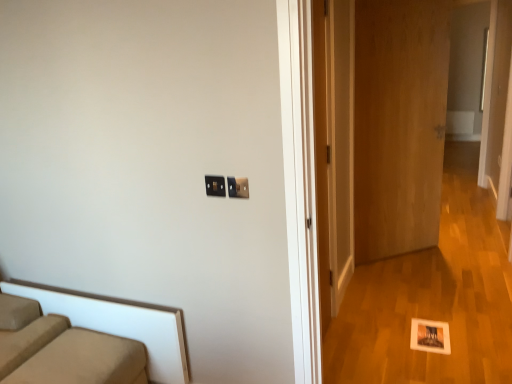
From the picture: What is the approximate height of wooden door at right, which is the 1th door in left-to-right order?

6.33 feet.

The image size is (512, 384). In order to click on wooden door at right, which is the 1th door in front-to-back order in this screenshot , I will do `click(334, 145)`.

Is matte black switch at upper center, the first electric outlet positioned from the right, at the left side of beige fabric studio couch at lower left?

In fact, matte black switch at upper center, the first electric outlet positioned from the right, is to the right of beige fabric studio couch at lower left.

From the image's perspective, is matte black switch at upper center, which ranks as the second electric outlet in left-to-right order, positioned above or below beige fabric studio couch at lower left?

Clearly, from the image's perspective, matte black switch at upper center, which ranks as the second electric outlet in left-to-right order, is above beige fabric studio couch at lower left.

Which point is more distant from viewer, (244, 188) or (129, 375)?

The point (129, 375) is behind.

Is beige fabric studio couch at lower left surrounded by matte black switch at upper center, which ranks as the second electric outlet in left-to-right order?

Actually, beige fabric studio couch at lower left is outside matte black switch at upper center, which ranks as the second electric outlet in left-to-right order.

Is wooden door at center, which ranks as the first door in back-to-front order, wider than beige fabric studio couch at lower left?

In fact, wooden door at center, which ranks as the first door in back-to-front order, might be narrower than beige fabric studio couch at lower left.

Where is `studio couch that appears below the wooden door at center, the 2th door positioned from the left (from the image's perspective)`? This screenshot has width=512, height=384. studio couch that appears below the wooden door at center, the 2th door positioned from the left (from the image's perspective) is located at coordinates [x=62, y=349].

In the scene shown: Which object is positioned more to the right, wooden door at center, which ranks as the first door in back-to-front order, or beige fabric studio couch at lower left?

Positioned to the right is wooden door at center, which ranks as the first door in back-to-front order.

Does wooden door at center, the 2th door positioned from the left, have a larger size compared to beige fabric studio couch at lower left?

Indeed, wooden door at center, the 2th door positioned from the left, has a larger size compared to beige fabric studio couch at lower left.

Identify the location of the 1st electric outlet counting from the right of the beige fabric studio couch at lower left. (215, 186).

From the image's perspective, relative to black plastic electric outlet at center, the 1th electric outlet when ordered from left to right, is beige fabric studio couch at lower left above or below?

Based on their image positions, beige fabric studio couch at lower left is located beneath black plastic electric outlet at center, the 1th electric outlet when ordered from left to right.

Between beige fabric studio couch at lower left and black plastic electric outlet at center, the second electric outlet viewed from the right, which one has smaller width?

black plastic electric outlet at center, the second electric outlet viewed from the right, is thinner.

Is beige fabric studio couch at lower left further to the viewer compared to black plastic electric outlet at center, the second electric outlet viewed from the right?

No.

Is wooden door at right, which is the 1th door in front-to-back order, inside or outside of black plastic electric outlet at center, the second electric outlet viewed from the right?

wooden door at right, which is the 1th door in front-to-back order, lies outside black plastic electric outlet at center, the second electric outlet viewed from the right.

From the image's perspective, would you say wooden door at right, placed as the second door when sorted from right to left, is shown under black plastic electric outlet at center, the second electric outlet viewed from the right?

No, from the image's perspective, wooden door at right, placed as the second door when sorted from right to left, is not below black plastic electric outlet at center, the second electric outlet viewed from the right.

Based on the photo, considering the relative sizes of wooden door at right, which is the 1th door in left-to-right order, and black plastic electric outlet at center, the 1th electric outlet when ordered from left to right, in the image provided, is wooden door at right, which is the 1th door in left-to-right order, taller than black plastic electric outlet at center, the 1th electric outlet when ordered from left to right,?

Indeed, wooden door at right, which is the 1th door in left-to-right order, has a greater height compared to black plastic electric outlet at center, the 1th electric outlet when ordered from left to right.

From the image's perspective, is matte black switch at upper center, which ranks as the second electric outlet in left-to-right order, above or below wooden door at right, which is the 1th door in front-to-back order?

matte black switch at upper center, which ranks as the second electric outlet in left-to-right order, is situated lower than wooden door at right, which is the 1th door in front-to-back order, in the image.

Are matte black switch at upper center, which ranks as the second electric outlet in left-to-right order, and wooden door at right, which is the 1th door in front-to-back order, beside each other?

No, matte black switch at upper center, which ranks as the second electric outlet in left-to-right order, is not making contact with wooden door at right, which is the 1th door in front-to-back order.

How many degrees apart are the facing directions of matte black switch at upper center, which ranks as the second electric outlet in left-to-right order, and wooden door at right, placed as the second door when sorted from right to left?

There is a 90.7-degree angle between the facing directions of matte black switch at upper center, which ranks as the second electric outlet in left-to-right order, and wooden door at right, placed as the second door when sorted from right to left.

Is matte black switch at upper center, which ranks as the second electric outlet in left-to-right order, bigger or smaller than wooden door at right, the 2th door viewed from the back?

matte black switch at upper center, which ranks as the second electric outlet in left-to-right order, is smaller than wooden door at right, the 2th door viewed from the back.

Find the location of a particular element. Image resolution: width=512 pixels, height=384 pixels. door lying below the wooden door at center, which ranks as the first door in back-to-front order (from the image's perspective) is located at coordinates (334, 145).

Measure the distance from wooden door at right, placed as the second door when sorted from right to left, to wooden door at center, which is counted as the first door, starting from the right.

17.41 inches.

Who is smaller, wooden door at right, which is the 1th door in front-to-back order, or wooden door at center, the 2th door positioned from the left?

With smaller size is wooden door at right, which is the 1th door in front-to-back order.

From the image's perspective, which one is positioned higher, black plastic electric outlet at center, the 1th electric outlet when ordered from left to right, or matte black switch at upper center, which ranks as the second electric outlet in left-to-right order?

From the image's view, black plastic electric outlet at center, the 1th electric outlet when ordered from left to right, is above.

In terms of height, does black plastic electric outlet at center, the 1th electric outlet when ordered from left to right, look taller or shorter compared to matte black switch at upper center, which ranks as the second electric outlet in left-to-right order?

In the image, black plastic electric outlet at center, the 1th electric outlet when ordered from left to right, appears to be shorter than matte black switch at upper center, which ranks as the second electric outlet in left-to-right order.

Consider the image. Can you confirm if black plastic electric outlet at center, the 1th electric outlet when ordered from left to right, is thinner than matte black switch at upper center, which ranks as the second electric outlet in left-to-right order?

Correct, the width of black plastic electric outlet at center, the 1th electric outlet when ordered from left to right, is less than that of matte black switch at upper center, which ranks as the second electric outlet in left-to-right order.

Which of these two, black plastic electric outlet at center, the 1th electric outlet when ordered from left to right, or matte black switch at upper center, which ranks as the second electric outlet in left-to-right order, is smaller?

black plastic electric outlet at center, the 1th electric outlet when ordered from left to right.

Starting from the beige fabric studio couch at lower left, which electric outlet is the 1st one behind? Please provide its 2D coordinates.

[(238, 187)]

From the image's perspective, count 2nd doors upward from the beige fabric studio couch at lower left and point to it. Please provide its 2D coordinates.

[(399, 124)]

Based on their spatial positions, is wooden door at center, which ranks as the first door in back-to-front order, or beige fabric studio couch at lower left further from wooden door at right, which is the 1th door in left-to-right order?

beige fabric studio couch at lower left lies further to wooden door at right, which is the 1th door in left-to-right order, than the other object.

When comparing their distances from wooden door at right, placed as the second door when sorted from right to left, does wooden door at center, which is counted as the first door, starting from the right, or matte black switch at upper center, the first electric outlet positioned from the right, seem closer?

Among the two, wooden door at center, which is counted as the first door, starting from the right, is located nearer to wooden door at right, placed as the second door when sorted from right to left.

Estimate the real-world distances between objects in this image. Which object is further from beige fabric studio couch at lower left, matte black switch at upper center, the first electric outlet positioned from the right, or wooden door at right, which is the 1th door in left-to-right order?

wooden door at right, which is the 1th door in left-to-right order, lies further to beige fabric studio couch at lower left than the other object.

Estimate the real-world distances between objects in this image. Which object is closer to matte black switch at upper center, the first electric outlet positioned from the right, wooden door at right, which is the 1th door in front-to-back order, or beige fabric studio couch at lower left?

beige fabric studio couch at lower left is closer to matte black switch at upper center, the first electric outlet positioned from the right.

Considering their positions, is wooden door at right, the 2th door viewed from the back, positioned closer to beige fabric studio couch at lower left than matte black switch at upper center, which ranks as the second electric outlet in left-to-right order?

matte black switch at upper center, which ranks as the second electric outlet in left-to-right order.

Which object lies further to the anchor point black plastic electric outlet at center, the 1th electric outlet when ordered from left to right, wooden door at center, the 2th door positioned from the left, or wooden door at right, which is the 1th door in left-to-right order?

The object further to black plastic electric outlet at center, the 1th electric outlet when ordered from left to right, is wooden door at center, the 2th door positioned from the left.

Which object lies further to the anchor point wooden door at right, the 2th door viewed from the back, beige fabric studio couch at lower left or black plastic electric outlet at center, the second electric outlet viewed from the right?

The object further to wooden door at right, the 2th door viewed from the back, is beige fabric studio couch at lower left.

Looking at the image, which one is located closer to beige fabric studio couch at lower left, wooden door at center, which appears as the 2th door when viewed from the front, or matte black switch at upper center, the first electric outlet positioned from the right?

matte black switch at upper center, the first electric outlet positioned from the right, is positioned closer to the anchor beige fabric studio couch at lower left.

Where is `electric outlet between black plastic electric outlet at center, the 1th electric outlet when ordered from left to right, and beige fabric studio couch at lower left vertically`? The image size is (512, 384). electric outlet between black plastic electric outlet at center, the 1th electric outlet when ordered from left to right, and beige fabric studio couch at lower left vertically is located at coordinates (238, 187).

The height and width of the screenshot is (384, 512). What are the coordinates of `electric outlet between matte black switch at upper center, which ranks as the second electric outlet in left-to-right order, and wooden door at center, which appears as the 2th door when viewed from the front, along the z-axis` in the screenshot? It's located at (215, 186).

Where is `door between matte black switch at upper center, which ranks as the second electric outlet in left-to-right order, and wooden door at center, which is counted as the first door, starting from the right, from front to back`? This screenshot has height=384, width=512. door between matte black switch at upper center, which ranks as the second electric outlet in left-to-right order, and wooden door at center, which is counted as the first door, starting from the right, from front to back is located at coordinates (334, 145).

Where is `door between black plastic electric outlet at center, the second electric outlet viewed from the right, and wooden door at center, the 2th door positioned from the left, from front to back`? Image resolution: width=512 pixels, height=384 pixels. door between black plastic electric outlet at center, the second electric outlet viewed from the right, and wooden door at center, the 2th door positioned from the left, from front to back is located at coordinates (334, 145).